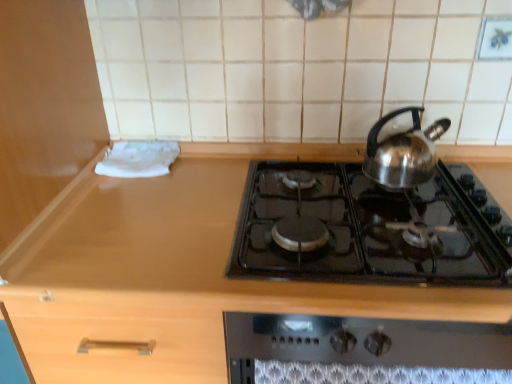
Image resolution: width=512 pixels, height=384 pixels. In order to click on vacant space to the right of shiny metallic kettle at upper right in this screenshot , I will do `click(464, 188)`.